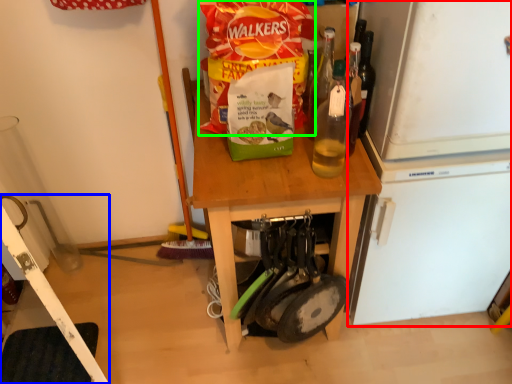
Question: Which object is positioned closest to appliance (highlighted by a red box)? Select from ladder (highlighted by a blue box) and cereal (highlighted by a green box).

Choices:
 (A) ladder
 (B) cereal

Answer: (B)